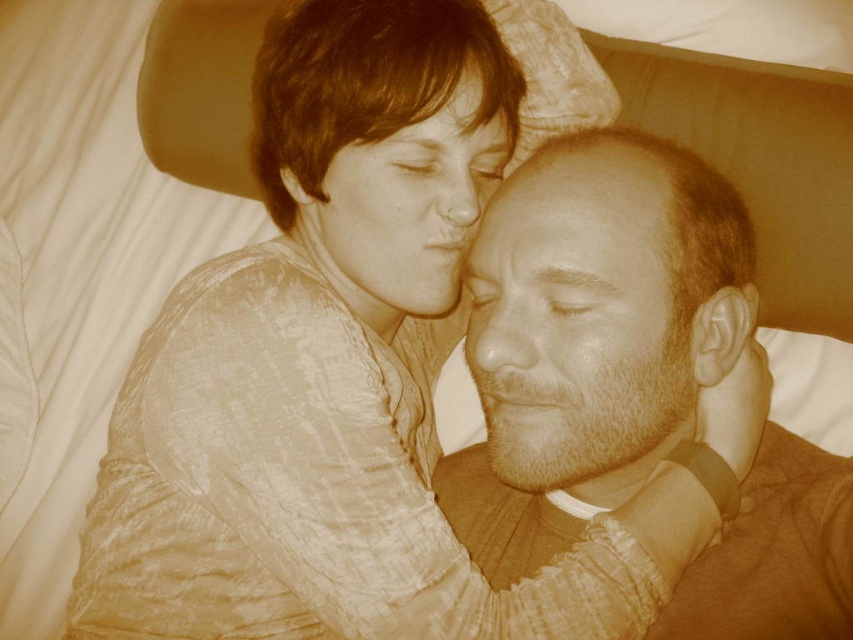
Question: Which object is positioned closest to the smooth skin face at upper center?

Choices:
 (A) beige textured skin at center
 (B) smooth brown shirt at center

Answer: (A)

Question: Which object is the farthest from the smooth skin face at upper center?

Choices:
 (A) smooth brown shirt at center
 (B) beige textured skin at center

Answer: (A)

Question: Is smooth brown shirt at center to the right of beige textured skin at center from the viewer's perspective?

Choices:
 (A) yes
 (B) no

Answer: (A)

Question: Is smooth brown shirt at center thinner than smooth skin face at upper center?

Choices:
 (A) no
 (B) yes

Answer: (A)

Question: Which object appears closest to the camera in this image?

Choices:
 (A) smooth skin face at upper center
 (B) beige textured skin at center
 (C) smooth brown shirt at center

Answer: (B)

Question: Is beige textured skin at center positioned behind smooth skin face at upper center?

Choices:
 (A) no
 (B) yes

Answer: (A)